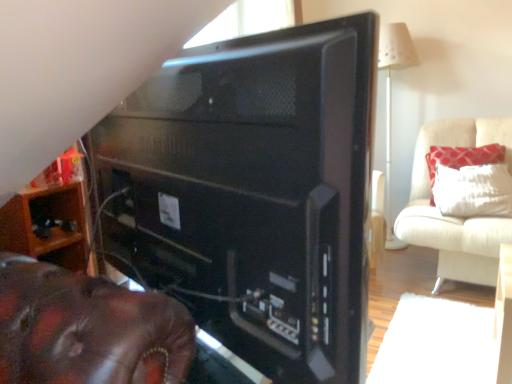
Question: Is white fabric cushion at upper right, which is the first furniture in back-to-front order, at the left side of white textured pillow at upper right?

Choices:
 (A) no
 (B) yes

Answer: (B)

Question: From a real-world perspective, is white fabric cushion at upper right, which is the first furniture in back-to-front order, physically below white textured pillow at upper right?

Choices:
 (A) yes
 (B) no

Answer: (A)

Question: From the image's perspective, is white fabric cushion at upper right, placed as the 2th furniture when sorted from front to back, on top of white textured pillow at upper right?

Choices:
 (A) yes
 (B) no

Answer: (B)

Question: Is white fabric cushion at upper right, which appears as the 2th furniture when viewed from the left, positioned with its back to white textured pillow at upper right?

Choices:
 (A) yes
 (B) no

Answer: (A)

Question: Could you tell me if white fabric cushion at upper right, which is the first furniture in back-to-front order, is turned towards white textured pillow at upper right?

Choices:
 (A) no
 (B) yes

Answer: (B)

Question: Does white fabric cushion at upper right, placed as the 2th furniture when sorted from front to back, lie behind white textured pillow at upper right?

Choices:
 (A) no
 (B) yes

Answer: (A)

Question: Does white textured pillow at upper right have a greater width compared to white fabric cushion at upper right, arranged as the 1th furniture when viewed from the right?

Choices:
 (A) no
 (B) yes

Answer: (A)

Question: Would you consider white textured pillow at upper right to be distant from white fabric cushion at upper right, which appears as the 2th furniture when viewed from the left?

Choices:
 (A) no
 (B) yes

Answer: (A)

Question: From the image's perspective, would you say white textured pillow at upper right is positioned over white fabric cushion at upper right, placed as the 2th furniture when sorted from front to back?

Choices:
 (A) yes
 (B) no

Answer: (A)

Question: Does white textured pillow at upper right have a smaller size compared to white fabric cushion at upper right, which is the first furniture in back-to-front order?

Choices:
 (A) yes
 (B) no

Answer: (A)

Question: Can we say white textured pillow at upper right lies outside white fabric cushion at upper right, arranged as the 1th furniture when viewed from the right?

Choices:
 (A) no
 (B) yes

Answer: (B)

Question: Is white textured pillow at upper right in front of white fabric cushion at upper right, arranged as the 1th furniture when viewed from the right?

Choices:
 (A) no
 (B) yes

Answer: (A)

Question: Is black matte desktop computer at center turned away from wooden shelf at lower left, positioned as the second furniture in back-to-front order?

Choices:
 (A) yes
 (B) no

Answer: (A)